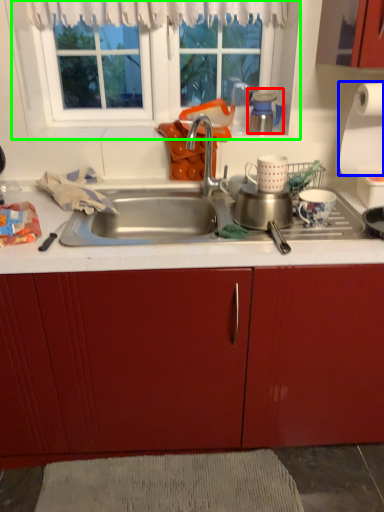
Question: Considering the real-world distances, which object is closest to appliance (highlighted by a red box)? paper towel (highlighted by a blue box) or window (highlighted by a green box).

Choices:
 (A) paper towel
 (B) window

Answer: (A)